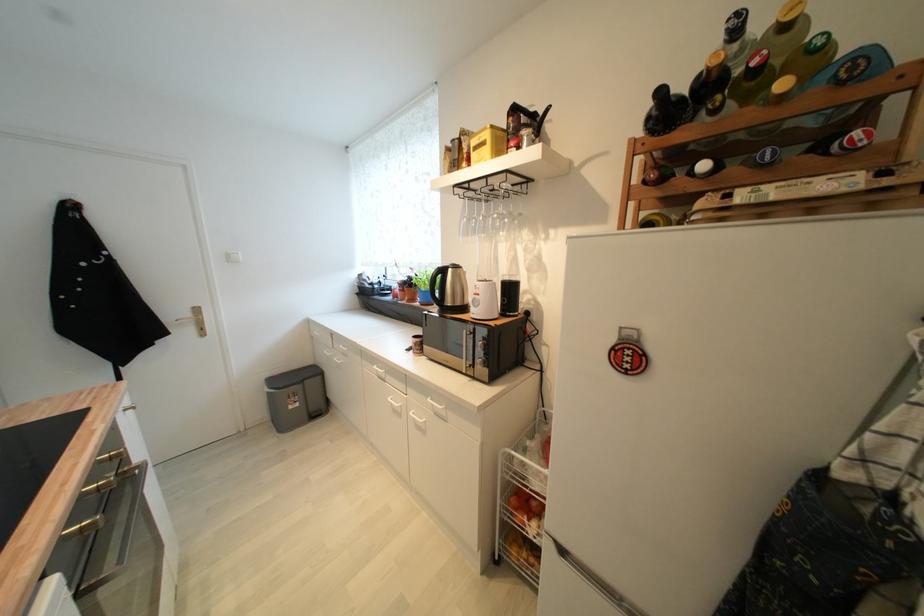
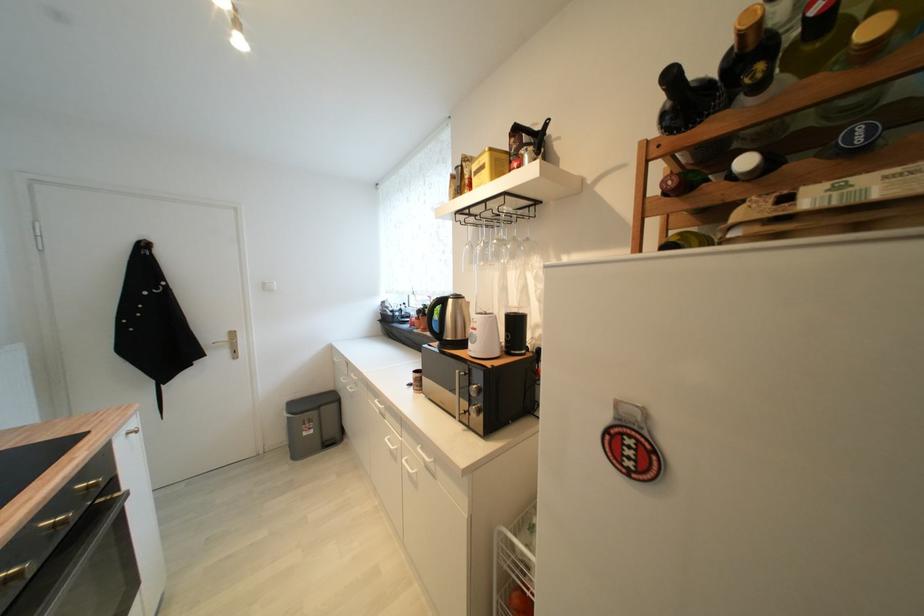
The images are taken continuously from a first-person perspective. In which direction are you moving?

The cameraman walked toward right, forward.